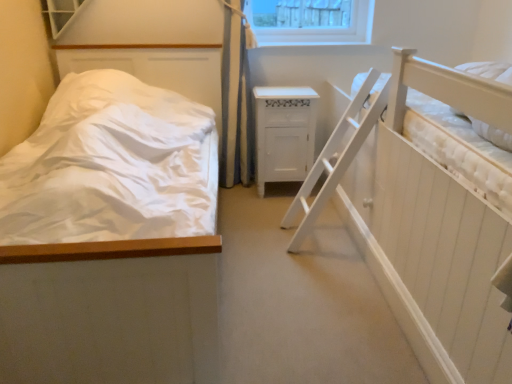
Question: Is point (264, 142) closer or farther from the camera than point (449, 357)?

Choices:
 (A) farther
 (B) closer

Answer: (A)

Question: From the image's perspective, is white wood cabinet at center located above or below white wooden hospital bed at right?

Choices:
 (A) above
 (B) below

Answer: (A)

Question: Which object is positioned closest to the white textured window at upper left?

Choices:
 (A) white matte bed at left
 (B) white wooden hospital bed at right
 (C) white wood cabinet at center

Answer: (A)

Question: Which object is positioned closest to the white wooden hospital bed at right?

Choices:
 (A) white textured window at upper left
 (B) white matte bed at left
 (C) white wood cabinet at center

Answer: (C)